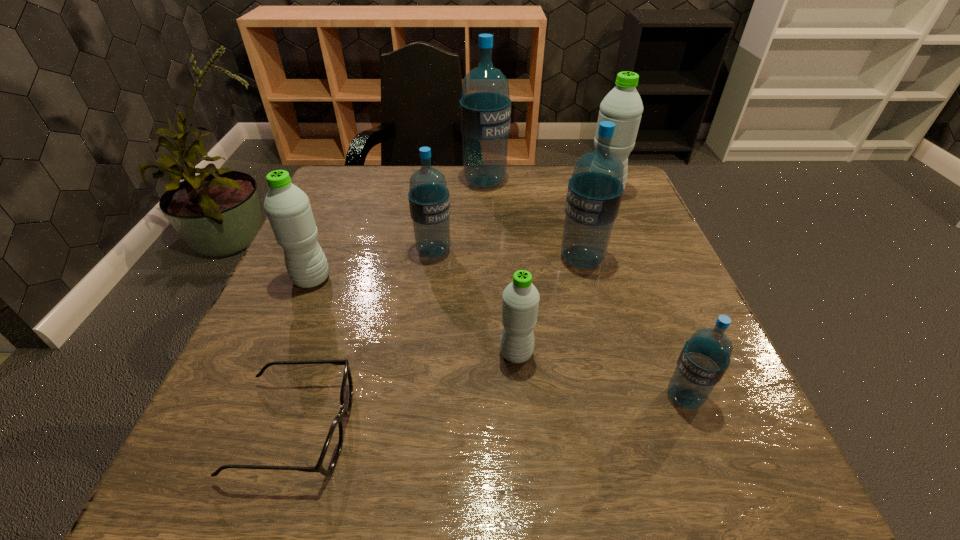
Identify the location of free point between the biggest green water bottle and the leftmost water bottle. [x=458, y=237].

Where is `empty location between the leftmost green water bottle and the leftmost blue water bottle`? empty location between the leftmost green water bottle and the leftmost blue water bottle is located at coordinates (372, 265).

Image resolution: width=960 pixels, height=540 pixels. Identify the location of free point between the sixth water bottle from right to left and the shortest object. (365, 340).

I want to click on vacant region between the nearest water bottle and the leftmost water bottle, so click(x=498, y=338).

Point out which object is positioned as the third nearest to the third object from right to left. Please provide its 2D coordinates. Your answer should be formatted as a tuple, i.e. [(x, y)], where the tuple contains the x and y coordinates of a point satisfying the conditions above.

[(429, 199)]

Select which object appears as the fourth closest to the rightmost blue water bottle. Please provide its 2D coordinates. Your answer should be formatted as a tuple, i.e. [(x, y)], where the tuple contains the x and y coordinates of a point satisfying the conditions above.

[(332, 447)]

Select which water bottle is the seventh closest to the shortest object. Please provide its 2D coordinates. Your answer should be formatted as a tuple, i.e. [(x, y)], where the tuple contains the x and y coordinates of a point satisfying the conditions above.

[(623, 106)]

Locate an element on the screen. The width and height of the screenshot is (960, 540). water bottle that is the sixth closest to the nearest water bottle is located at coordinates (287, 207).

Select which blue water bottle appears as the third closest to the rightmost green water bottle. Please provide its 2D coordinates. Your answer should be formatted as a tuple, i.e. [(x, y)], where the tuple contains the x and y coordinates of a point satisfying the conditions above.

[(429, 199)]

Locate which blue water bottle is the third closest to the shortest object. Please provide its 2D coordinates. Your answer should be formatted as a tuple, i.e. [(x, y)], where the tuple contains the x and y coordinates of a point satisfying the conditions above.

[(705, 357)]